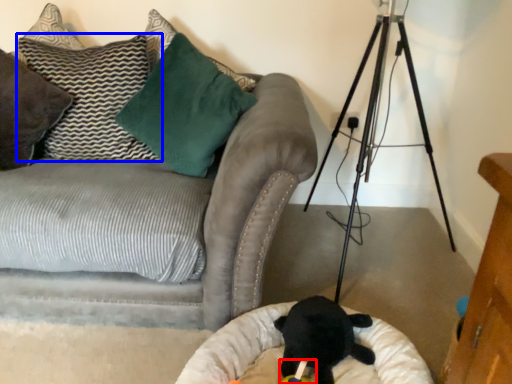
Question: Which of the following is the closest to the observer, toy (highlighted by a red box) or pillow (highlighted by a blue box)?

Choices:
 (A) toy
 (B) pillow

Answer: (A)